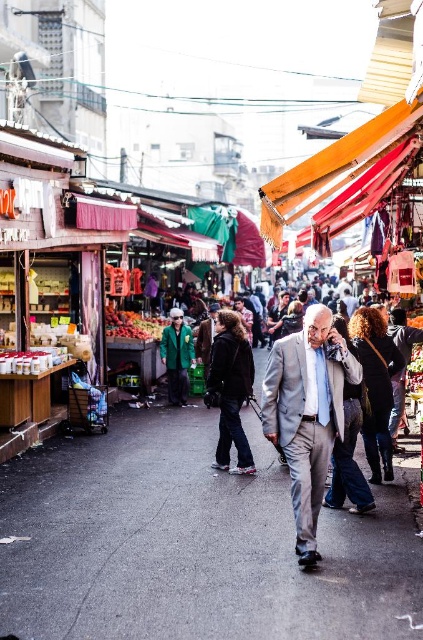
You are a delivery person who needs to navigate through the bustling street market scene. The gray asphalt alley at center is located at coordinates point 0.852, 0.452. Can you confirm if this alley is positioned towards the upper or lower half of the image?

The gray asphalt alley at center is located at point (x=191, y=545), which places it in the lower half of the image since the y coordinate is less than 0.5.

You are a photographer trying to capture both the gray suit at center and the green fabric jacket at center in the same frame. Given that your camera has a fixed focal length, which of the two objects should you focus on to ensure both are in focus without adjusting the camera settings?

You should focus on the gray suit at center because its width is larger than the green fabric jacket at center, making it easier to keep both in focus by centering the focus on the larger object.